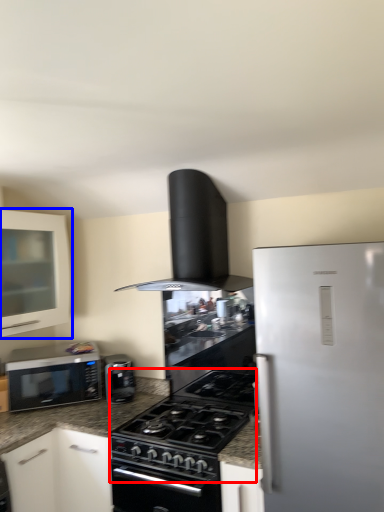
Question: Which point is further to the camera, gas stove (highlighted by a red box) or cabinetry (highlighted by a blue box)?

Choices:
 (A) gas stove
 (B) cabinetry

Answer: (B)